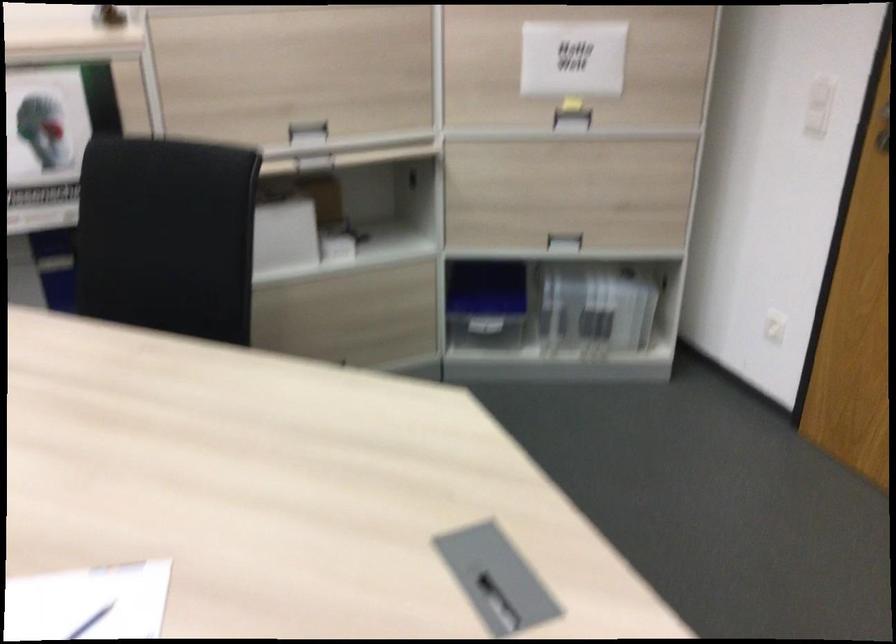
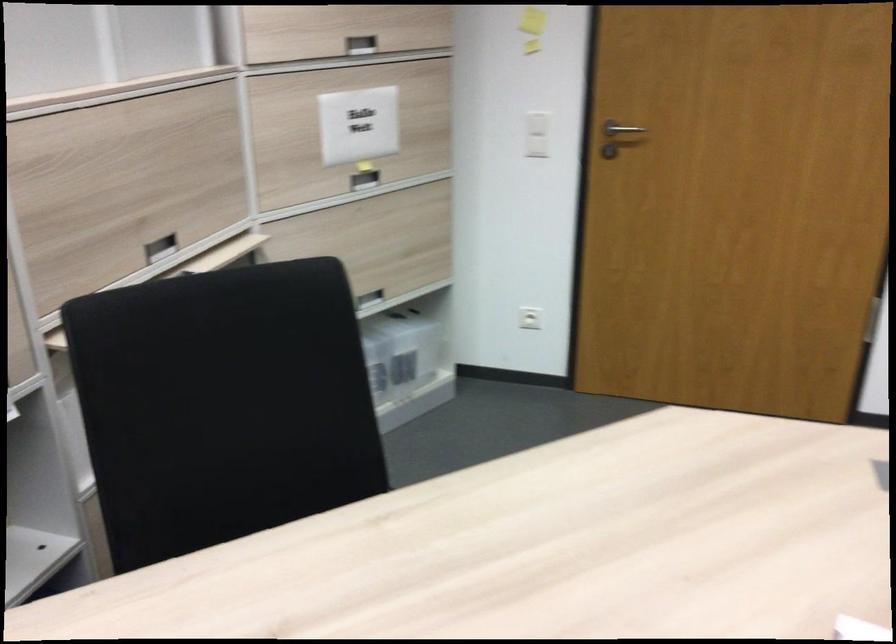
Question: I am providing you with two images of the same scene from different viewpoints. Which of the following objects are not visible in image2?

Choices:
 (A) plastic storage box
 (B) recessed cabinet handle
 (C) black cabinet handle
 (D) red rose object

Answer: (C)